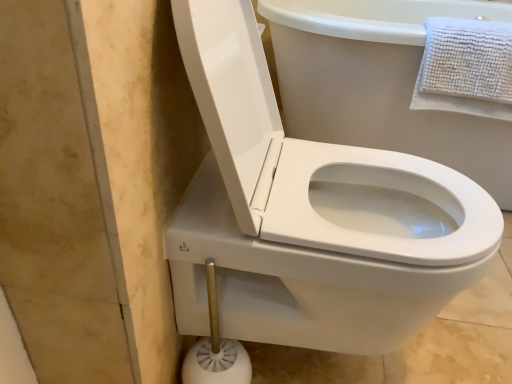
Where is `white textured towel at upper right`? The image size is (512, 384). white textured towel at upper right is located at coordinates (466, 68).

What do you see at coordinates (216, 348) in the screenshot?
I see `white plastic toilet brush at lower center` at bounding box center [216, 348].

This screenshot has height=384, width=512. What are the coordinates of `white glossy toilet at center` in the screenshot? It's located at (333, 249).

Locate an element on the screen. This screenshot has width=512, height=384. white textured towel at upper right is located at coordinates (466, 68).

Identify the location of towel bar beneath the white glossy toilet at center (from a real-world perspective). This screenshot has height=384, width=512. (216, 348).

Considering the sizes of white plastic toilet brush at lower center and white glossy toilet at center in the image, is white plastic toilet brush at lower center wider or thinner than white glossy toilet at center?

Considering their sizes, white plastic toilet brush at lower center looks slimmer than white glossy toilet at center.

Which of these two, white plastic toilet brush at lower center or white glossy toilet at center, stands taller?

With more height is white glossy toilet at center.

Does white plastic toilet brush at lower center come in front of white glossy toilet at center?

No, white plastic toilet brush at lower center is further to the viewer.

Is the position of white textured towel at upper right less distant than that of white plastic toilet brush at lower center?

No, white textured towel at upper right is further to the viewer.

Is white textured towel at upper right turned away from white plastic toilet brush at lower center?

No, white plastic toilet brush at lower center is not at the back of white textured towel at upper right.

Is white textured towel at upper right far from white plastic toilet brush at lower center?

white textured towel at upper right is actually quite close to white plastic toilet brush at lower center.

Is white textured towel at upper right to the left of white plastic toilet brush at lower center from the viewer's perspective?

No.

Is white textured towel at upper right at the back of white plastic toilet brush at lower center?

No, white plastic toilet brush at lower center's orientation is not away from white textured towel at upper right.

Is white plastic toilet brush at lower center inside the boundaries of white textured towel at upper right, or outside?

white plastic toilet brush at lower center exists outside the volume of white textured towel at upper right.

Which object is positioned more to the left, white plastic toilet brush at lower center or white textured towel at upper right?

From the viewer's perspective, white plastic toilet brush at lower center appears more on the left side.

Is white glossy toilet at center oriented away from white textured towel at upper right?

No, white glossy toilet at center is not facing away from white textured towel at upper right.

From the image's perspective, is white glossy toilet at center beneath white textured towel at upper right?

Yes, from the image's perspective, white glossy toilet at center is below white textured towel at upper right.

Locate an element on the screen. bidet that appears in front of the white textured towel at upper right is located at coordinates point(333,249).

Between white glossy toilet at center and white textured towel at upper right, which one appears on the right side from the viewer's perspective?

From the viewer's perspective, white textured towel at upper right appears more on the right side.

Considering the sizes of objects white textured towel at upper right and white glossy toilet at center in the image provided, who is smaller, white textured towel at upper right or white glossy toilet at center?

With smaller size is white textured towel at upper right.

Which is closer to the camera, (504, 52) or (384, 215)?

Clearly, point (504, 52) is more distant from the camera than point (384, 215).

Does white textured towel at upper right appear on the left side of white glossy toilet at center?

In fact, white textured towel at upper right is to the right of white glossy toilet at center.

Can you confirm if white glossy toilet at center is positioned to the right of white plastic toilet brush at lower center?

Yes, white glossy toilet at center is to the right of white plastic toilet brush at lower center.

Which object is closer to the camera taking this photo, white glossy toilet at center or white plastic toilet brush at lower center?

Positioned in front is white glossy toilet at center.

Considering the relative sizes of white glossy toilet at center and white plastic toilet brush at lower center in the image provided, is white glossy toilet at center smaller than white plastic toilet brush at lower center?

Actually, white glossy toilet at center might be larger than white plastic toilet brush at lower center.

Where is `bidet that is on the right side of white plastic toilet brush at lower center`? This screenshot has height=384, width=512. bidet that is on the right side of white plastic toilet brush at lower center is located at coordinates (333, 249).

The width and height of the screenshot is (512, 384). I want to click on towel bar on the left side of white textured towel at upper right, so click(x=216, y=348).

In the scene shown: From the image, which object appears to be farther from white plastic toilet brush at lower center, white textured towel at upper right or white glossy toilet at center?

white textured towel at upper right is positioned further to the anchor white plastic toilet brush at lower center.

Estimate the real-world distances between objects in this image. Which object is closer to white textured towel at upper right, white plastic toilet brush at lower center or white glossy toilet at center?

white glossy toilet at center.

Estimate the real-world distances between objects in this image. Which object is closer to white glossy toilet at center, white plastic toilet brush at lower center or white textured towel at upper right?

Among the two, white plastic toilet brush at lower center is located nearer to white glossy toilet at center.

When comparing their distances from white textured towel at upper right, does white glossy toilet at center or white plastic toilet brush at lower center seem further?

white plastic toilet brush at lower center is further to white textured towel at upper right.

From the image, which object appears to be nearer to white glossy toilet at center, white textured towel at upper right or white plastic toilet brush at lower center?

white plastic toilet brush at lower center.

From the picture: Which object lies nearer to the anchor point white plastic toilet brush at lower center, white glossy toilet at center or white textured towel at upper right?

white glossy toilet at center.

You are a GUI agent. You are given a task and a screenshot of the screen. Output one action in this format:
    pyautogui.click(x=<x>, y=<y>)
    Task: Click on the bidet situated between white plastic toilet brush at lower center and white textured towel at upper right from left to right
    
    Given the screenshot: What is the action you would take?
    pyautogui.click(x=333, y=249)